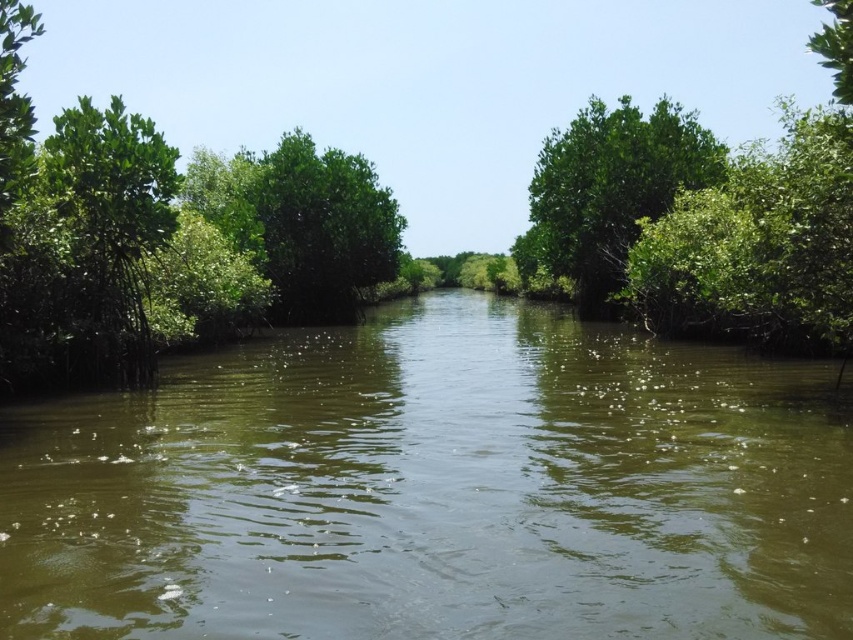
Does green murky water at center have a smaller size compared to green leafy tree at center?

Yes, green murky water at center is smaller than green leafy tree at center.

Between green murky water at center and green leafy tree at center, which one appears on the right side from the viewer's perspective?

green leafy tree at center is more to the right.

Between point (190, 611) and point (616, 138), which one is positioned in front?

Positioned in front is point (190, 611).

I want to click on green murky water at center, so click(436, 488).